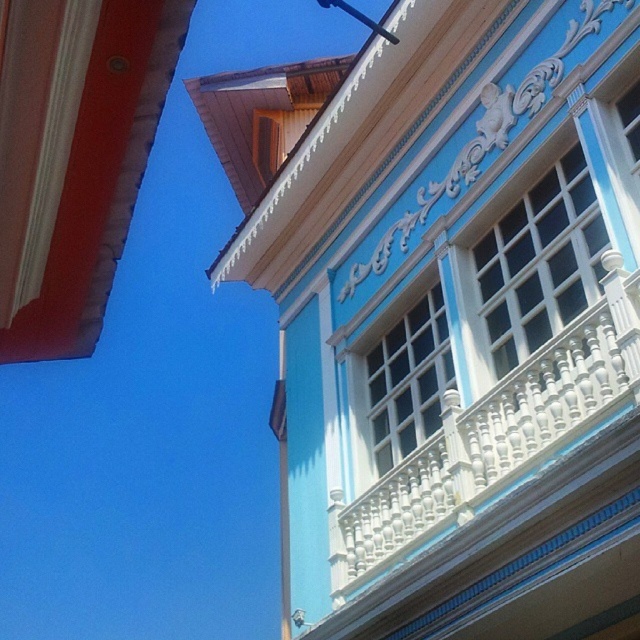
Question: Which point is closer to the camera?

Choices:
 (A) (557, 296)
 (B) (561, 422)

Answer: (B)

Question: Is white textured wood at upper right positioned at the back of metallic pole at upper center?

Choices:
 (A) yes
 (B) no

Answer: (B)

Question: Observing the image, what is the correct spatial positioning of white textured wood at upper right in reference to white wooden window at center?

Choices:
 (A) left
 (B) right

Answer: (B)

Question: Is white carved wood balcony at upper right further to the viewer compared to white textured wood at upper right?

Choices:
 (A) yes
 (B) no

Answer: (B)

Question: Among these points, which one is farthest from the camera?

Choices:
 (A) (429, 486)
 (B) (371, 387)

Answer: (B)

Question: Which of the following is the farthest from the observer?

Choices:
 (A) metallic pole at upper center
 (B) white carved wood balcony at upper right

Answer: (A)